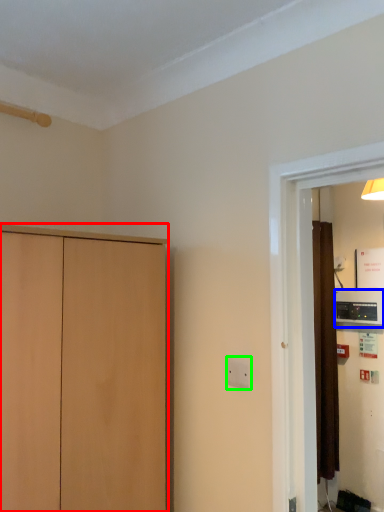
Question: Which is farther away from cupboard (highlighted by a red box)? appliance (highlighted by a blue box) or electric outlet (highlighted by a green box)?

Choices:
 (A) appliance
 (B) electric outlet

Answer: (A)